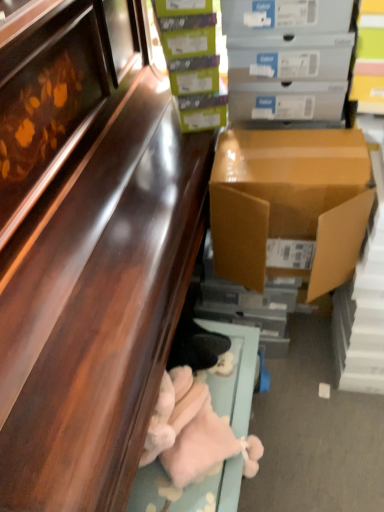
Where is `blank space situated above brown cardboard box at right, placed as the third box when sorted from top to bottom (from a real-world perspective)`? blank space situated above brown cardboard box at right, placed as the third box when sorted from top to bottom (from a real-world perspective) is located at coordinates (293, 156).